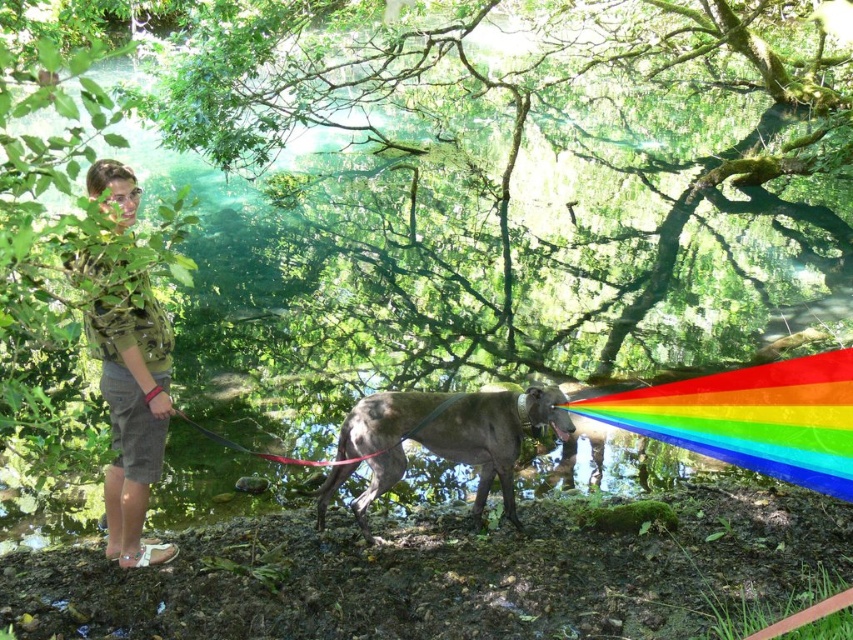
You are a photographer trying to capture a shot of the rainbow plastic at center and the green camouflage shirt at upper left. Which object should you focus on first if you want to include both in your frame without moving the camera?

The rainbow plastic at center is positioned on the right side of green camouflage shirt at upper left, so you should focus on the green camouflage shirt at upper left first to ensure both are in the frame without moving the camera.